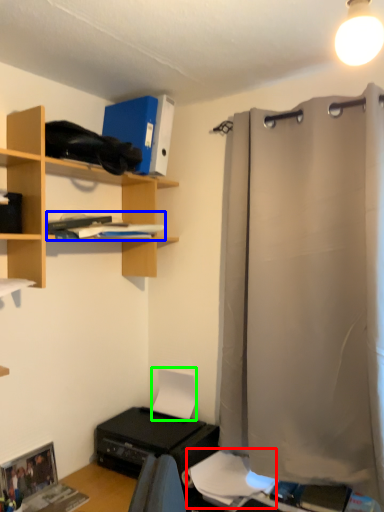
Question: Estimate the real-world distances between objects in this image. Which object is closer to sheet (highlighted by a red box), book (highlighted by a blue box) or paper (highlighted by a green box)?

Choices:
 (A) book
 (B) paper

Answer: (B)